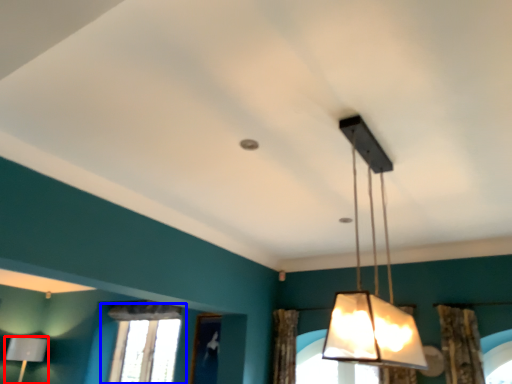
Question: Which object is closer to the camera taking this photo, lamp (highlighted by a red box) or window (highlighted by a blue box)?

Choices:
 (A) lamp
 (B) window

Answer: (B)